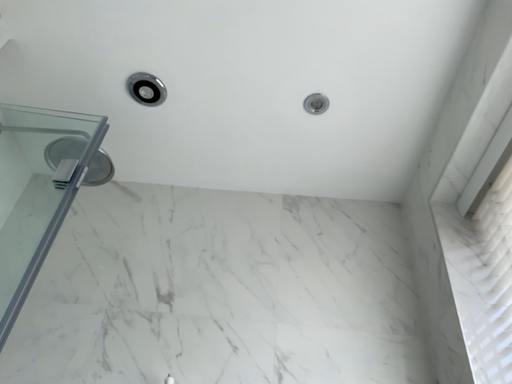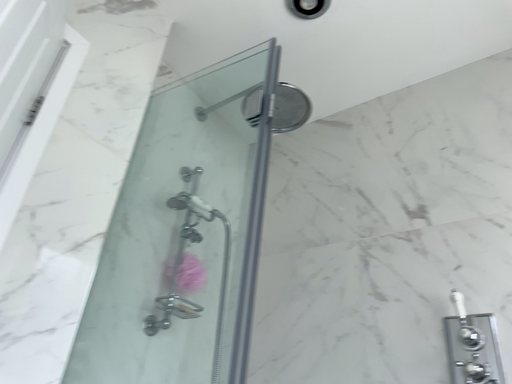
Question: Which way did the camera rotate in the video?

Choices:
 (A) rotated left
 (B) rotated right

Answer: (A)